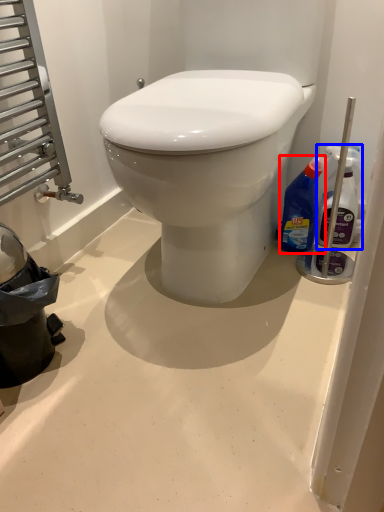
Question: Which object appears farthest to the camera in this image, bottle (highlighted by a red box) or bottle (highlighted by a blue box)?

Choices:
 (A) bottle
 (B) bottle

Answer: (A)